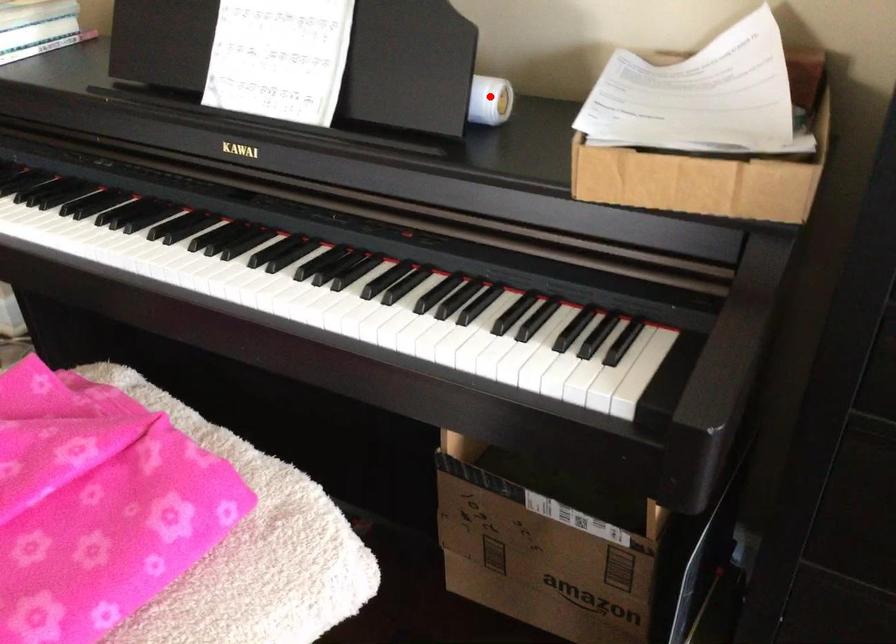
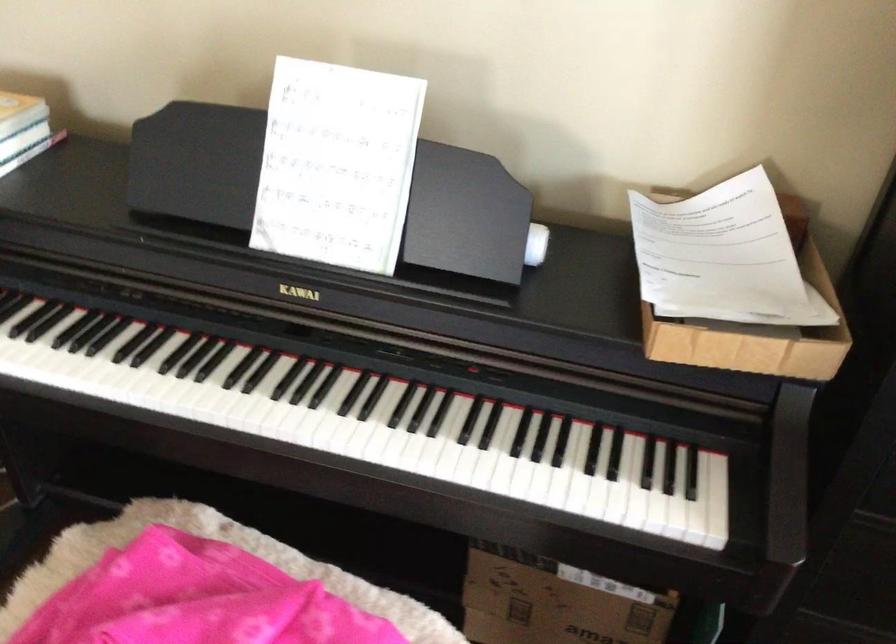
Question: I am providing you with two images of the same scene from different viewpoints. Given a red point in image1, look at the same physical point in image2. Is it:

Choices:
 (A) Closer to the viewpoint
 (B) Farther from the viewpoint

Answer: (B)